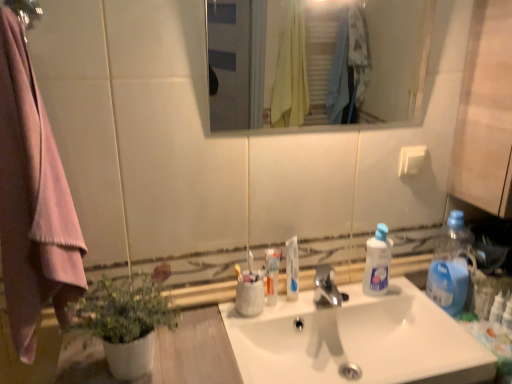
The width and height of the screenshot is (512, 384). I want to click on vacant space that is in between transparent plastic bottle at sink, marked as the 1th bottle in a left-to-right arrangement, and satin nickel faucet at center, so click(360, 301).